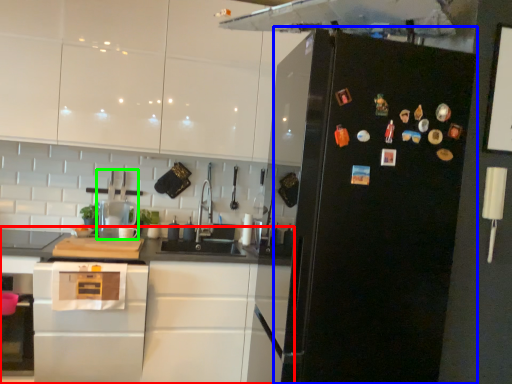
Question: Which object is the farthest from cabinetry (highlighted by a red box)? Choose among these: refrigerator (highlighted by a blue box) or kitchen appliance (highlighted by a green box).

Choices:
 (A) refrigerator
 (B) kitchen appliance

Answer: (A)